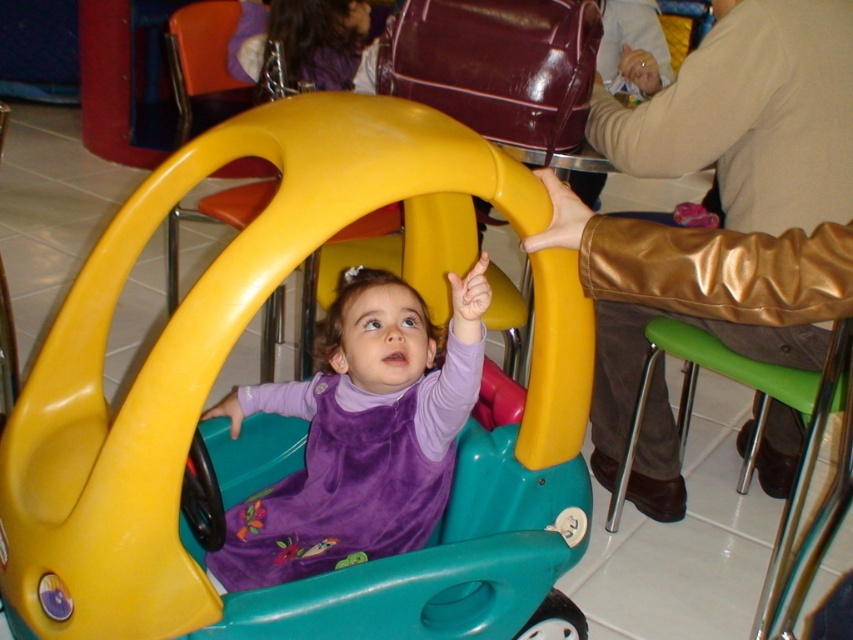
Question: Can you confirm if matte plastic toy car at center is positioned to the right of purple velvet toddler at center?

Choices:
 (A) yes
 (B) no

Answer: (A)

Question: Can you confirm if matte plastic toy car at center is thinner than purple velvet toddler at center?

Choices:
 (A) no
 (B) yes

Answer: (A)

Question: Which point is closer to the camera taking this photo?

Choices:
 (A) (80, 316)
 (B) (401, 342)

Answer: (A)

Question: Does matte plastic toy car at center appear on the left side of purple velvet toddler at center?

Choices:
 (A) yes
 (B) no

Answer: (B)

Question: Which point is farther from the camera taking this photo?

Choices:
 (A) (271, 545)
 (B) (39, 355)

Answer: (A)

Question: Among these points, which one is farthest from the camera?

Choices:
 (A) (427, 336)
 (B) (251, 243)

Answer: (A)